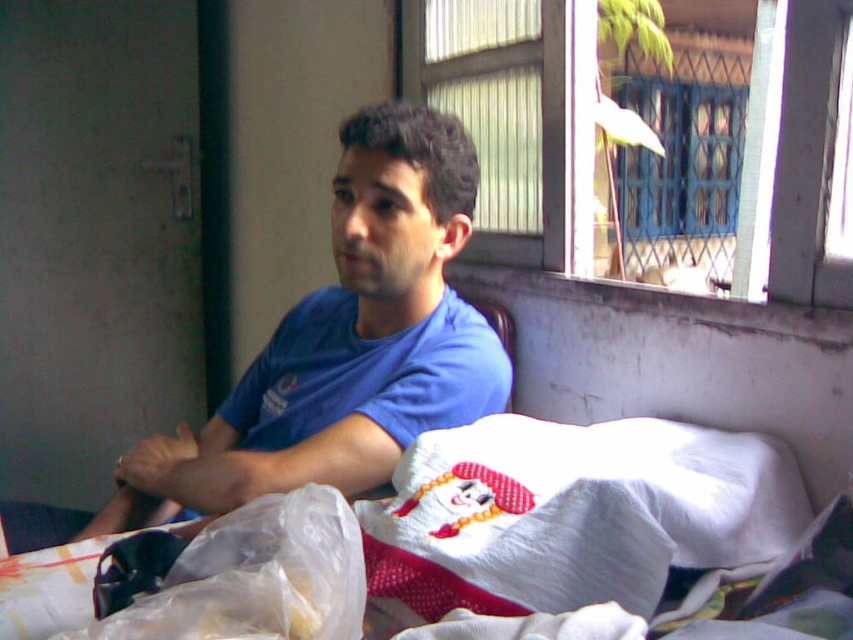
Is blue cotton shirt at center bigger than white cotton pillow at lower center?

Yes.

Locate an element on the screen. This screenshot has height=640, width=853. blue cotton shirt at center is located at coordinates (345, 340).

What do you see at coordinates (345, 340) in the screenshot? This screenshot has width=853, height=640. I see `blue cotton shirt at center` at bounding box center [345, 340].

Where is `blue cotton shirt at center`? blue cotton shirt at center is located at coordinates (345, 340).

Which is more to the left, blue cotton shirt at center or white cotton bed at center?

From the viewer's perspective, blue cotton shirt at center appears more on the left side.

Does point (381, 353) lie in front of point (83, 618)?

That is False.

Locate an element on the screen. The image size is (853, 640). blue cotton shirt at center is located at coordinates (345, 340).

Is white cotton bed at center wider than white cotton pillow at lower center?

Correct, the width of white cotton bed at center exceeds that of white cotton pillow at lower center.

Is white cotton bed at center to the left of white cotton pillow at lower center from the viewer's perspective?

Correct, you'll find white cotton bed at center to the left of white cotton pillow at lower center.

Is point (759, 506) more distant than point (604, 442)?

No, (759, 506) is closer to viewer.

Where is `white cotton bed at center`? This screenshot has height=640, width=853. white cotton bed at center is located at coordinates (589, 518).